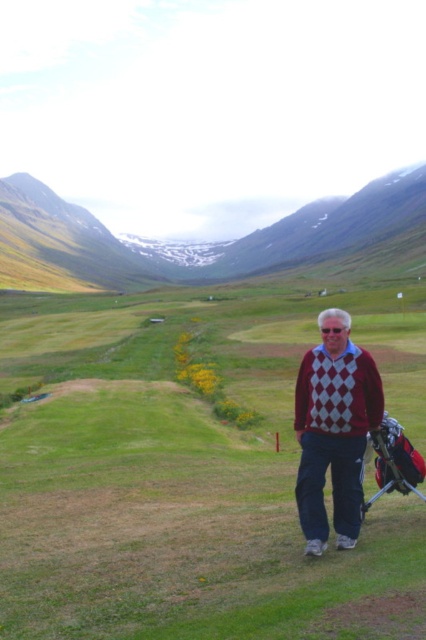
Who is more forward, (77, 435) or (97, 284)?

Point (77, 435) is more forward.

Describe the element at coordinates (192, 472) in the screenshot. I see `green grassy field at center` at that location.

Find the location of a particular element. This screenshot has width=426, height=640. green grassy field at center is located at coordinates (192, 472).

Does point (80, 582) lie behind point (310, 442)?

No, (80, 582) is closer to viewer.

Between point (373, 541) and point (351, 380), which one is positioned behind?

Point (351, 380)

Locate an element on the screen. The height and width of the screenshot is (640, 426). green grassy field at center is located at coordinates (x=192, y=472).

Can you confirm if green grassy hillside at center is taller than maroon diamond-patterned sweater at center?

Correct, green grassy hillside at center is much taller as maroon diamond-patterned sweater at center.

Identify the location of green grassy hillside at center. The image size is (426, 640). (189, 244).

At what (x,y) coordinates should I click in order to perform the action: click on green grassy hillside at center. Please return your answer as a coordinate pair (x, y). Looking at the image, I should click on (189, 244).